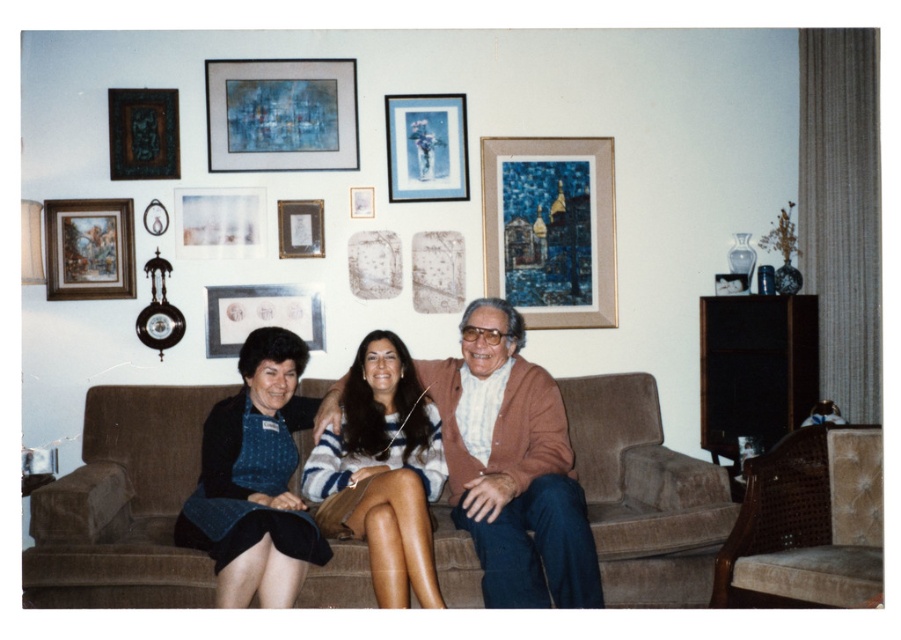
Can you confirm if blue textured painting at upper center is wider than dark blue fabric picture frame at upper left?

Indeed, blue textured painting at upper center has a greater width compared to dark blue fabric picture frame at upper left.

Between point (344, 116) and point (108, 115), which one is positioned in front?

Positioned in front is point (108, 115).

Locate an element on the screen. blue textured painting at upper center is located at coordinates (281, 115).

In the scene shown: Does velvet brown armchair at lower right appear over blue paper at upper center?

Actually, velvet brown armchair at lower right is below blue paper at upper center.

Is velvet brown armchair at lower right positioned at the back of blue paper at upper center?

That is False.

You are a GUI agent. You are given a task and a screenshot of the screen. Output one action in this format:
    pyautogui.click(x=<x>, y=<y>)
    Task: Click on the velvet brown armchair at lower right
    This screenshot has width=901, height=640.
    Given the screenshot: What is the action you would take?
    point(807,524)

Does point (335, 454) come behind point (240, 188)?

No, it is not.

Is striped sweater at center smaller than matte white picture frame at upper left?

Actually, striped sweater at center might be larger than matte white picture frame at upper left.

At what (x,y) coordinates should I click in order to perform the action: click on striped sweater at center. Please return your answer as a coordinate pair (x, y). Looking at the image, I should click on (381, 472).